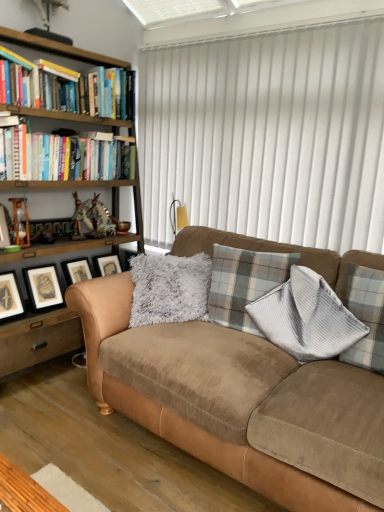
Locate an element on the screen. This screenshot has height=512, width=384. plaid fabric pillow at center is located at coordinates (244, 283).

The height and width of the screenshot is (512, 384). What do you see at coordinates (229, 397) in the screenshot?
I see `suede couch at center` at bounding box center [229, 397].

What are the coordinates of `wooden bookshelf at left` in the screenshot? It's located at (38, 339).

This screenshot has width=384, height=512. What do you see at coordinates (61, 157) in the screenshot?
I see `hardcover books at left` at bounding box center [61, 157].

How much space does black matte picture frame at lower left, which ranks as the 1th picture frame in right-to-left order, occupy vertically?

black matte picture frame at lower left, which ranks as the 1th picture frame in right-to-left order, is 33.76 centimeters tall.

What are the coordinates of `plaid fabric pillow at center` in the screenshot? It's located at (244, 283).

In the scene shown: Which object is wider, hardcover books at left or suede couch at center?

Wider between the two is suede couch at center.

Is hardcover books at left shorter than suede couch at center?

Indeed, hardcover books at left has a lesser height compared to suede couch at center.

From a real-world perspective, is suede couch at center above or below white vertical blinds at upper center?

In terms of real-world spatial position, suede couch at center is below white vertical blinds at upper center.

Which is more distant, (380, 413) or (209, 104)?

The point (209, 104) is farther from the camera.

Is suede couch at center turned away from white vertical blinds at upper center?

suede couch at center does not have its back to white vertical blinds at upper center.

In the scene shown: Is black matte picture frame at lower left, which ranks as the 2th picture frame in left-to-right order, inside wooden picture frame at left, positioned as the first picture frame in top-to-bottom order?

Definitely not — black matte picture frame at lower left, which ranks as the 2th picture frame in left-to-right order, is not inside wooden picture frame at left, positioned as the first picture frame in top-to-bottom order.

Does wooden picture frame at left, positioned as the first picture frame in top-to-bottom order, appear on the left side of black matte picture frame at lower left, which ranks as the 1th picture frame in right-to-left order?

Indeed, wooden picture frame at left, positioned as the first picture frame in top-to-bottom order, is positioned on the left side of black matte picture frame at lower left, which ranks as the 1th picture frame in right-to-left order.

From a real-world perspective, does wooden picture frame at left, positioned as the first picture frame in front-to-back order, stand above black matte picture frame at lower left, the 2th picture frame from the front?

Yes, from a real-world perspective, wooden picture frame at left, positioned as the first picture frame in front-to-back order, is over black matte picture frame at lower left, the 2th picture frame from the front

Considering the relative sizes of wooden picture frame at left, which appears as the 2th picture frame when viewed from the right, and black matte picture frame at lower left, acting as the 2th picture frame starting from the top, in the image provided, is wooden picture frame at left, which appears as the 2th picture frame when viewed from the right, thinner than black matte picture frame at lower left, acting as the 2th picture frame starting from the top,?

Correct, the width of wooden picture frame at left, which appears as the 2th picture frame when viewed from the right, is less than that of black matte picture frame at lower left, acting as the 2th picture frame starting from the top.

In the image, there is a wooden picture frame at left, positioned as the first picture frame in front-to-back order. Identify the location of bookcase above it (from the image's perspective). The image size is (384, 512). [x=38, y=339].

Can you confirm if wooden picture frame at left, positioned as the first picture frame in top-to-bottom order, is bigger than wooden bookshelf at left?

No, wooden picture frame at left, positioned as the first picture frame in top-to-bottom order, is not bigger than wooden bookshelf at left.

Which object is closer to the camera taking this photo, wooden picture frame at left, positioned as the first picture frame in front-to-back order, or wooden bookshelf at left?

wooden bookshelf at left is closer to the camera.

Locate an element on the screen. This screenshot has width=384, height=512. window blind on the right of hardcover books at left is located at coordinates (268, 136).

Can you confirm if hardcover books at left is bigger than white vertical blinds at upper center?

No, hardcover books at left is not bigger than white vertical blinds at upper center.

From the image's perspective, which object appears higher, hardcover books at left or white vertical blinds at upper center?

white vertical blinds at upper center is shown above in the image.

Is wooden bookshelf at left oriented away from hardcover books at left?

Yes, wooden bookshelf at left's orientation is away from hardcover books at left.

Which point is more forward, (27, 358) or (110, 134)?

The point (27, 358) is closer.

Based on their positions, is wooden bookshelf at left located to the left or right of hardcover books at left?

wooden bookshelf at left is to the left of hardcover books at left.

Find the location of a particular element. studio couch below the hardcover books at left (from a real-world perspective) is located at coordinates (229, 397).

Is suede couch at center to the right of hardcover books at left from the viewer's perspective?

Correct, you'll find suede couch at center to the right of hardcover books at left.

Considering the relative sizes of suede couch at center and hardcover books at left in the image provided, is suede couch at center shorter than hardcover books at left?

Incorrect, the height of suede couch at center does not fall short of that of hardcover books at left.

Which is behind, point (367, 507) or point (11, 142)?

The point (11, 142) is behind.

Identify the location of studio couch located below the hardcover books at left (from the image's perspective). [229, 397].

Find the location of `studio couch located underneath the white vertical blinds at upper center (from a real-world perspective)`. studio couch located underneath the white vertical blinds at upper center (from a real-world perspective) is located at coordinates (229, 397).

Based on their spatial positions, is wooden bookshelf at left or wooden picture frame at left, the 2th picture frame in the back-to-front sequence, further from plaid fabric pillow at center?

Based on the image, wooden picture frame at left, the 2th picture frame in the back-to-front sequence, appears to be further to plaid fabric pillow at center.

Looking at the image, which one is located further to wooden bookshelf at left, hardcover books at left or black matte picture frame at lower left, the 2th picture frame from the front?

The object further to wooden bookshelf at left is black matte picture frame at lower left, the 2th picture frame from the front.

Based on their spatial positions, is plaid fabric pillow at center or suede couch at center further from wooden picture frame at left, the 2th picture frame in the back-to-front sequence?

Among the two, suede couch at center is located further to wooden picture frame at left, the 2th picture frame in the back-to-front sequence.

Which object lies nearer to the anchor point wooden picture frame at left, positioned as the first picture frame in front-to-back order, hardcover books at left or suede couch at center?

hardcover books at left is positioned closer to the anchor wooden picture frame at left, positioned as the first picture frame in front-to-back order.

When comparing their distances from hardcover books at left, does wooden picture frame at left, positioned as the first picture frame in front-to-back order, or white vertical blinds at upper center seem further?

Based on the image, white vertical blinds at upper center appears to be further to hardcover books at left.

When comparing their distances from black matte picture frame at lower left, positioned as the first picture frame in back-to-front order, does plaid fabric pillow at center or suede couch at center seem closer?

suede couch at center lies closer to black matte picture frame at lower left, positioned as the first picture frame in back-to-front order, than the other object.

Based on their spatial positions, is white vertical blinds at upper center or wooden picture frame at left, positioned as the first picture frame in top-to-bottom order, further from suede couch at center?

Based on the image, wooden picture frame at left, positioned as the first picture frame in top-to-bottom order, appears to be further to suede couch at center.

Which object lies further to the anchor point white vertical blinds at upper center, wooden picture frame at left, positioned as the first picture frame in top-to-bottom order, or suede couch at center?

wooden picture frame at left, positioned as the first picture frame in top-to-bottom order, lies further to white vertical blinds at upper center than the other object.

What are the coordinates of `studio couch between black matte picture frame at lower left, which ranks as the 2th picture frame in left-to-right order, and plaid fabric pillow at center from left to right` in the screenshot? It's located at (229, 397).

In order to click on window blind between suede couch at center and hardcover books at left from front to back in this screenshot , I will do `click(268, 136)`.

Locate an element on the screen. The height and width of the screenshot is (512, 384). bookcase between suede couch at center and hardcover books at left in the front-back direction is located at coordinates (38, 339).

I want to click on book between wooden bookshelf at left and plaid fabric pillow at center, so click(61, 157).